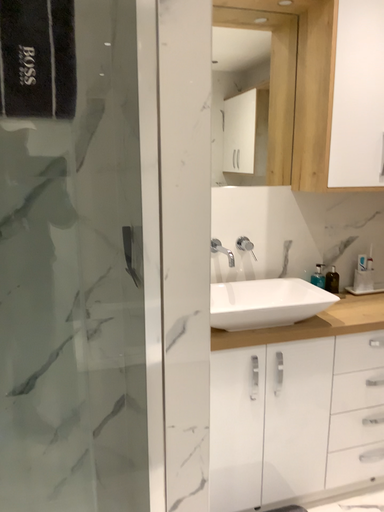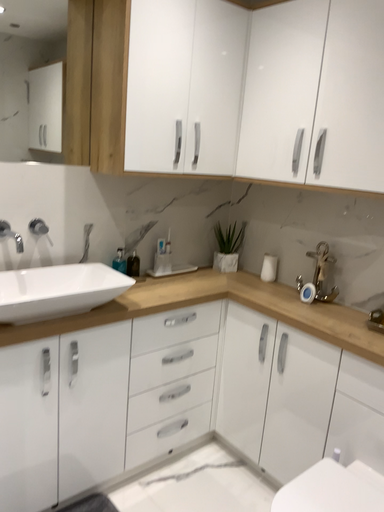
Question: Which way did the camera rotate in the video?

Choices:
 (A) rotated right
 (B) rotated left

Answer: (A)